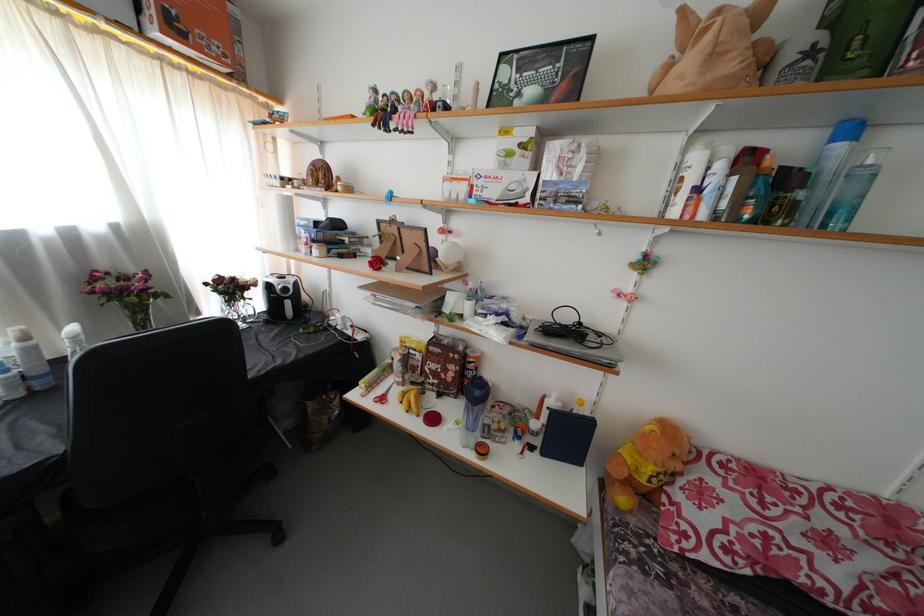
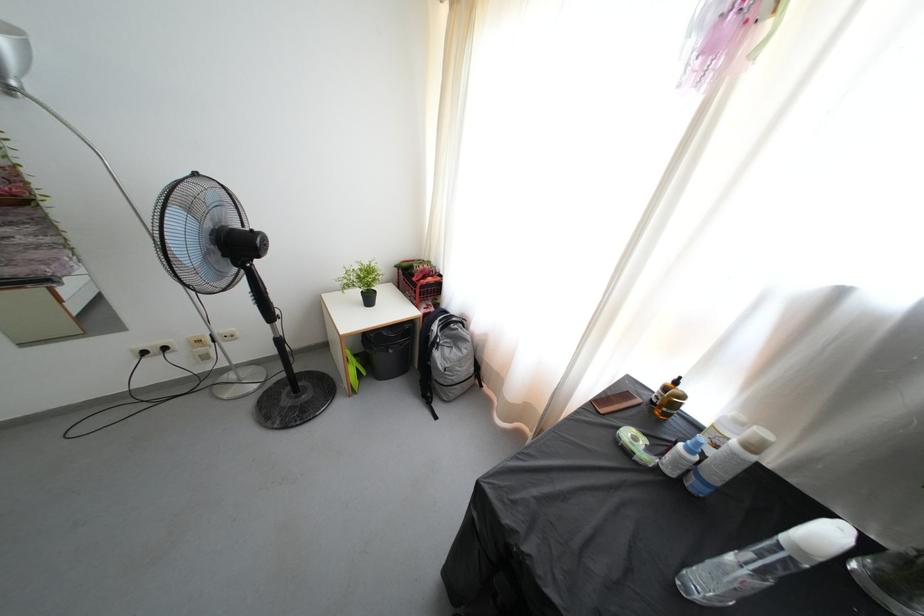
The first image is from the beginning of the video and the second image is from the end. How did the camera likely rotate when shooting the video?

The camera rotated toward left-down.